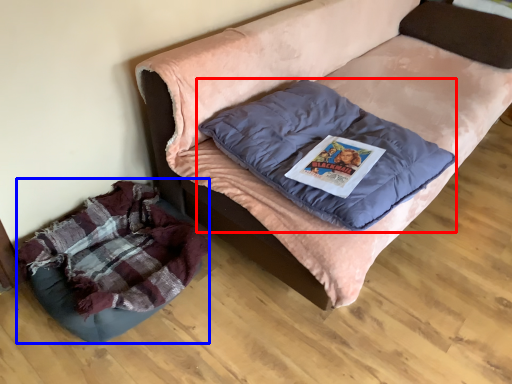
Question: Which object appears farthest to the camera in this image, pillow (highlighted by a red box) or dog bed (highlighted by a blue box)?

Choices:
 (A) pillow
 (B) dog bed

Answer: (B)